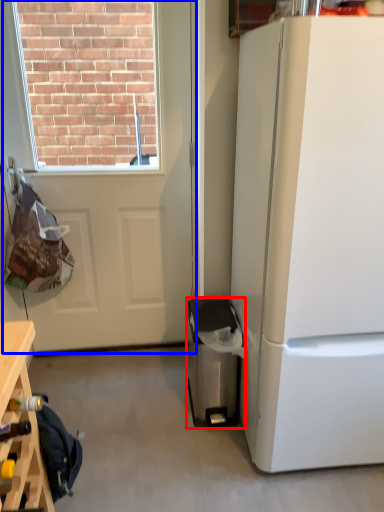
Question: Among these objects, which one is nearest to the camera, trash bin/can (highlighted by a red box) or door (highlighted by a blue box)?

Choices:
 (A) trash bin/can
 (B) door

Answer: (B)